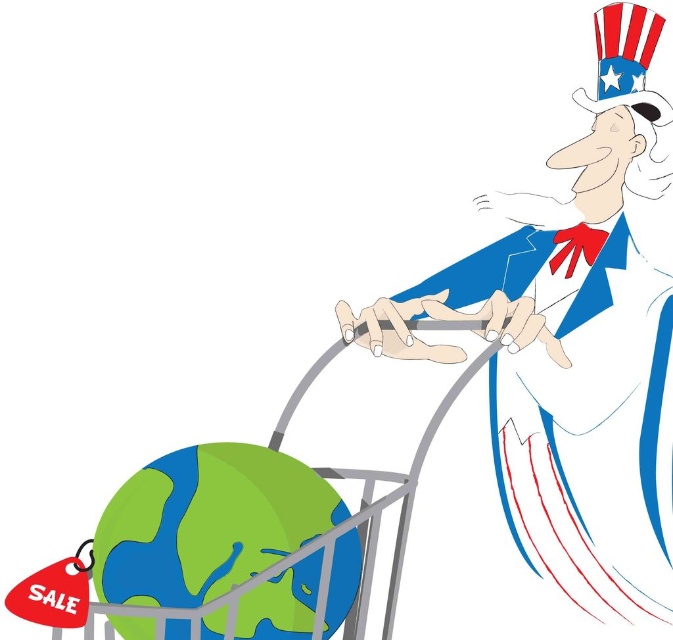
Which is in front, point (125, 564) or point (398, 525)?

Point (125, 564) is in front.

Who is positioned more to the right, green matte globe at lower left or metallic gray trolley at lower left?

Positioned to the right is metallic gray trolley at lower left.

The image size is (673, 640). What do you see at coordinates (207, 522) in the screenshot? I see `green matte globe at lower left` at bounding box center [207, 522].

Where is `green matte globe at lower left`? The width and height of the screenshot is (673, 640). green matte globe at lower left is located at coordinates (207, 522).

Who is more forward, (662, 156) or (100, 548)?

Positioned in front is point (100, 548).

Does white paper man at right have a lesser width compared to green matte globe at lower left?

→ In fact, white paper man at right might be wider than green matte globe at lower left.

Is point (540, 477) positioned in front of point (250, 540)?

No.

Find the location of `white paper man at right`. white paper man at right is located at coordinates (577, 342).

Measure the distance from white paper man at right to metallic gray trolley at lower left.

white paper man at right is 9.18 inches from metallic gray trolley at lower left.

Which is behind, point (530, 196) or point (452, 323)?

The point (530, 196) is more distant.

Locate an element on the screen. The image size is (673, 640). white paper man at right is located at coordinates (577, 342).